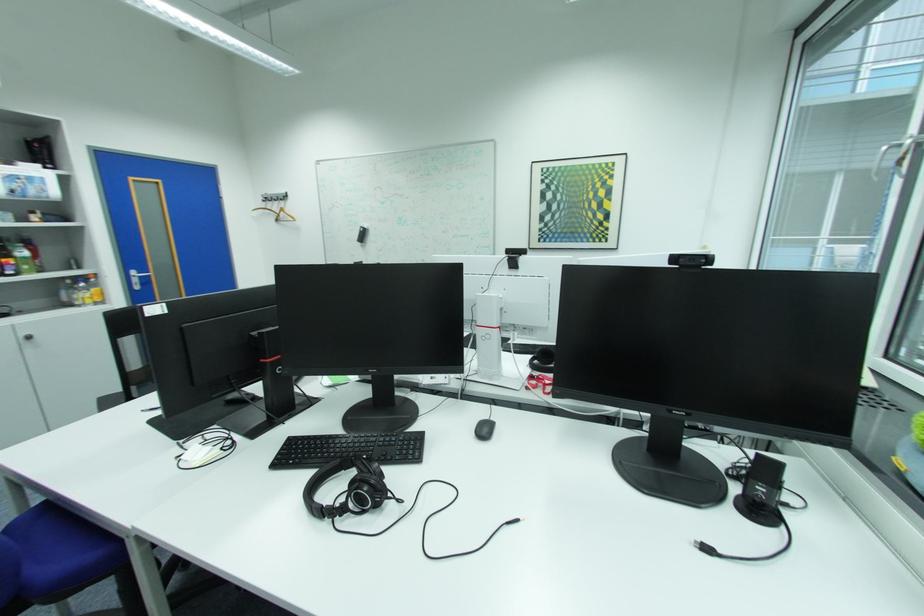
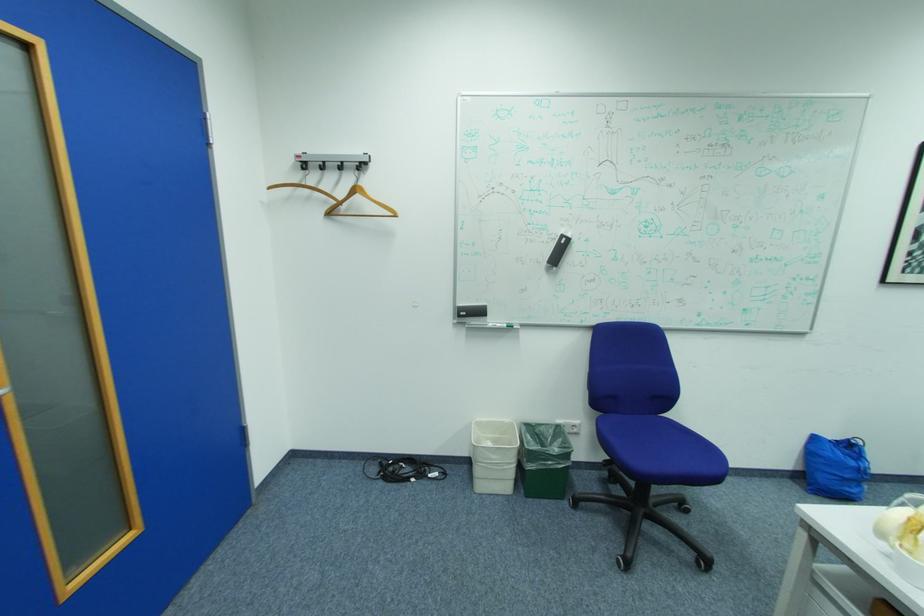
Where in the second image is the point corresponding to point 285,221 from the first image?

(337, 214)